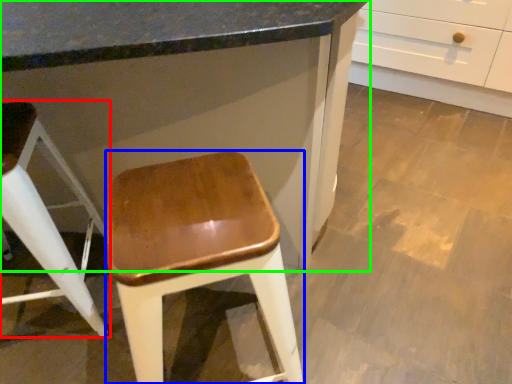
Question: Which object is positioned closest to stool (highlighted by a red box)? Select from stool (highlighted by a blue box) and cabinetry (highlighted by a green box).

Choices:
 (A) stool
 (B) cabinetry

Answer: (B)